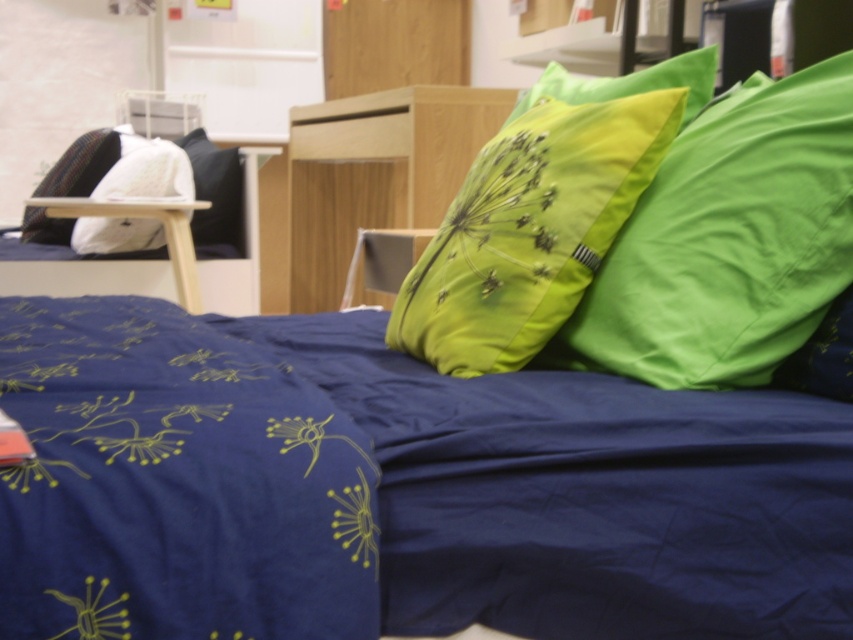
Question: Which of the following is the closest to the observer?

Choices:
 (A) knitted fabric pillow at left
 (B) matte black pillow at upper left

Answer: (A)

Question: Is green fabric pillow at upper right to the right of knitted fabric pillow at left from the viewer's perspective?

Choices:
 (A) no
 (B) yes

Answer: (B)

Question: Which object is the farthest from the matte black pillow at upper left?

Choices:
 (A) knitted fabric pillow at left
 (B) navy blue satin blanket at lower left

Answer: (B)

Question: Can you confirm if navy blue satin blanket at lower left is positioned below green fabric pillow at upper right?

Choices:
 (A) no
 (B) yes

Answer: (B)

Question: Which of the following is the closest to the observer?

Choices:
 (A) (701, 378)
 (B) (621, 124)

Answer: (A)

Question: Is green fabric pillow at center to the left of white soft pillow at upper left from the viewer's perspective?

Choices:
 (A) yes
 (B) no

Answer: (B)